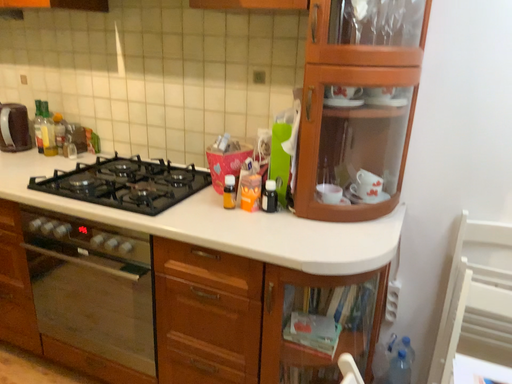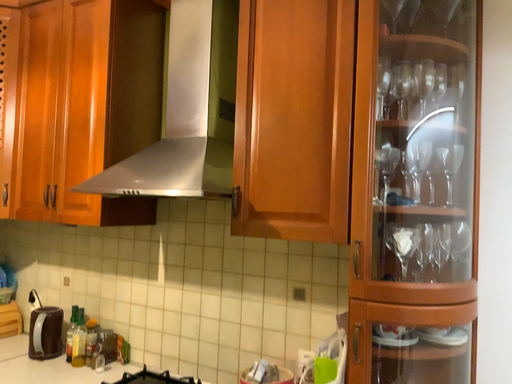
Question: Which way did the camera rotate in the video?

Choices:
 (A) rotated upward
 (B) rotated downward

Answer: (A)